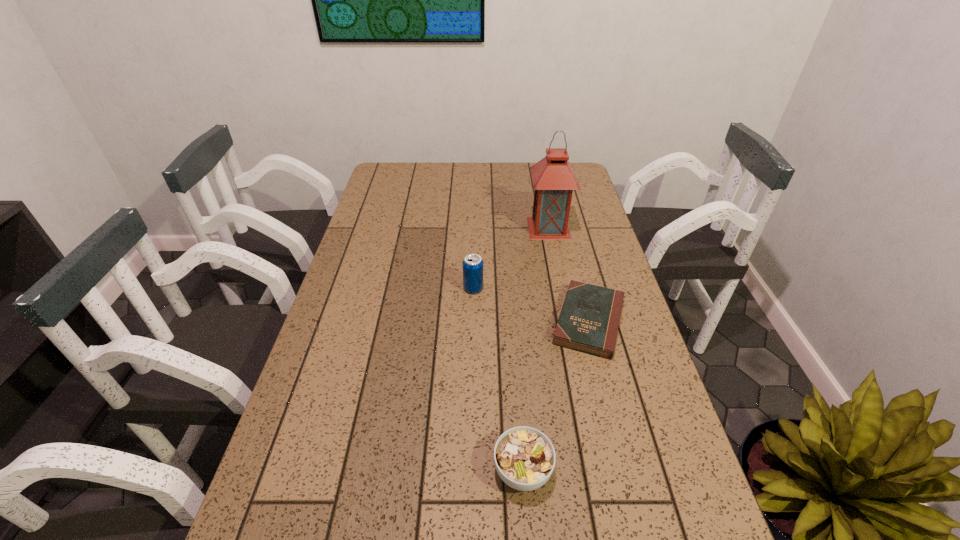
Where is `free spot between the Bible and the tallest object`? The width and height of the screenshot is (960, 540). free spot between the Bible and the tallest object is located at coordinates (568, 275).

Locate an element on the screen. The image size is (960, 540). free point between the second object from left to right and the second tallest object is located at coordinates (498, 380).

The image size is (960, 540). In order to click on empty space between the farthest object and the pop soda in this screenshot , I will do `click(511, 258)`.

Identify the location of empty space between the tallest object and the Bible. (568, 275).

Find the location of `free space between the nearest object and the Bible`. free space between the nearest object and the Bible is located at coordinates (556, 396).

Identify the location of free spot between the third tallest object and the lantern. This screenshot has width=960, height=540. (536, 349).

Identify the location of object that ranks as the closest to the nearest object. Image resolution: width=960 pixels, height=540 pixels. coord(589,320).

Locate which object ranks in proximity to the leftmost object. Please provide its 2D coordinates. Your answer should be formatted as a tuple, i.e. [(x, y)], where the tuple contains the x and y coordinates of a point satisfying the conditions above.

[(589, 320)]

This screenshot has height=540, width=960. I want to click on free space that satisfies the following two spatial constraints: 1. on the front side of the lantern; 2. on the right side of the Bible, so click(567, 321).